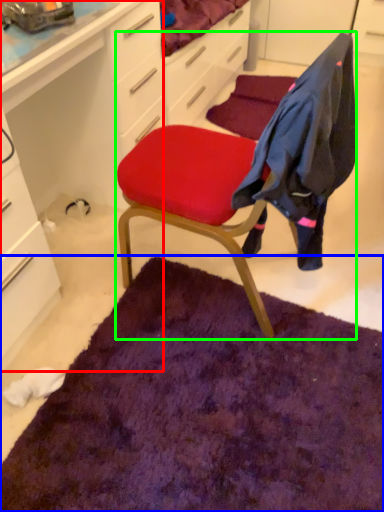
Question: Which object is positioned farthest from computer desk (highlighted by a red box)? Select from mat (highlighted by a blue box) and chair (highlighted by a green box).

Choices:
 (A) mat
 (B) chair

Answer: (A)